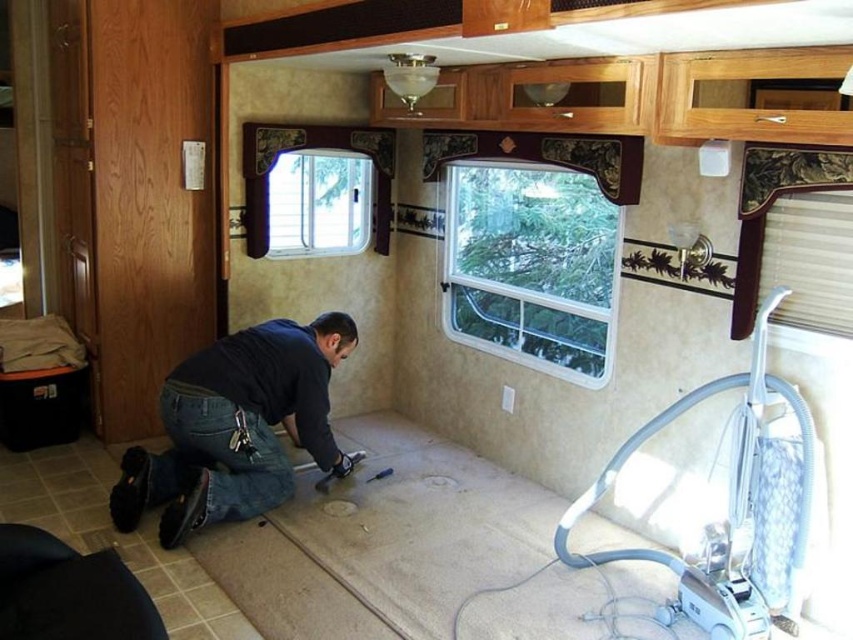
You are standing inside an RV and need to find where your dark blue jeans at lower left are in relation to the clear glass window at upper left. Based on the scene, can you determine if the jeans are positioned above or below the window?

The dark blue jeans at lower left are below the clear glass window at upper left.

You are inside an RV and need to reach a point behind you. Which of the two points, point 1 at coordinates [506,248] or point 2 at [212,497], is located behind your current position?

Point 1 at coordinates [506,248] is behind point 2 at [212,497], so if you are at point 2, point 1 would be behind you.